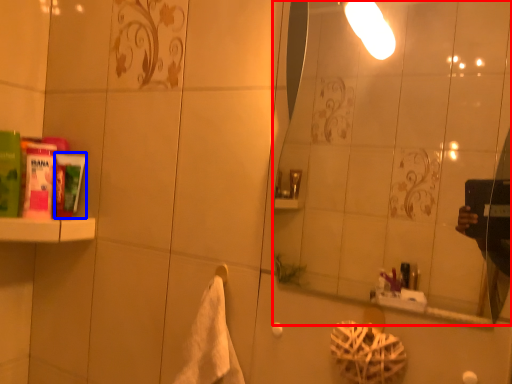
Question: Which of the following is the closest to the observer, mirror (highlighted by a red box) or mouthwash (highlighted by a blue box)?

Choices:
 (A) mirror
 (B) mouthwash

Answer: (A)